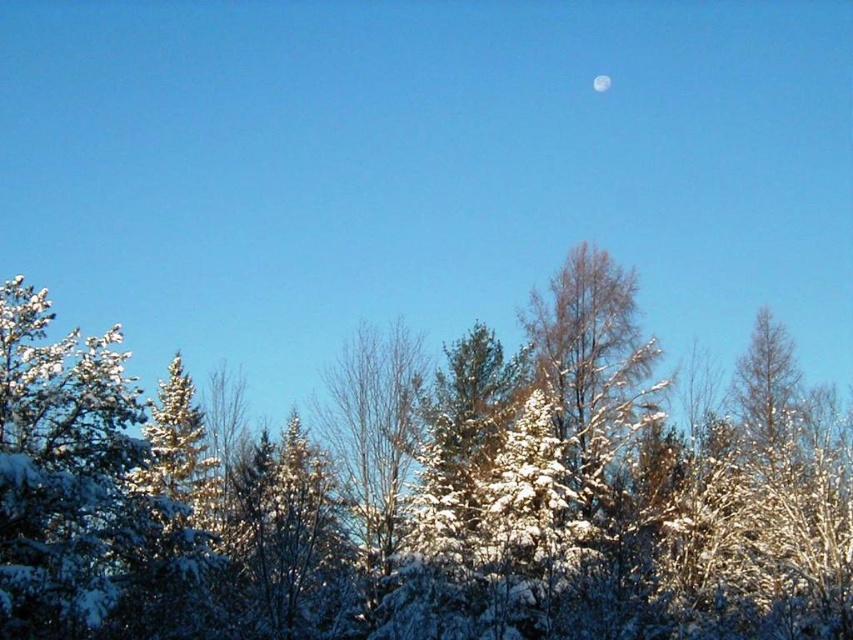
Question: Which point appears closest to the camera in this image?

Choices:
 (A) (480, 420)
 (B) (596, 83)

Answer: (A)

Question: Among these objects, which one is farthest from the camera?

Choices:
 (A) white glossy moon at upper center
 (B) white snow-covered trees at center

Answer: (A)

Question: Is white snow-covered trees at center below white glossy moon at upper center?

Choices:
 (A) yes
 (B) no

Answer: (A)

Question: Does white snow-covered trees at center appear under white glossy moon at upper center?

Choices:
 (A) yes
 (B) no

Answer: (A)

Question: Does white snow-covered trees at center have a greater width compared to white glossy moon at upper center?

Choices:
 (A) yes
 (B) no

Answer: (A)